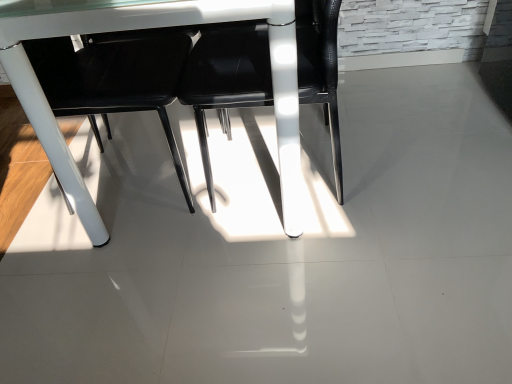
Locate an element on the screen. This screenshot has height=384, width=512. free space in front of white glossy table at center is located at coordinates (239, 297).